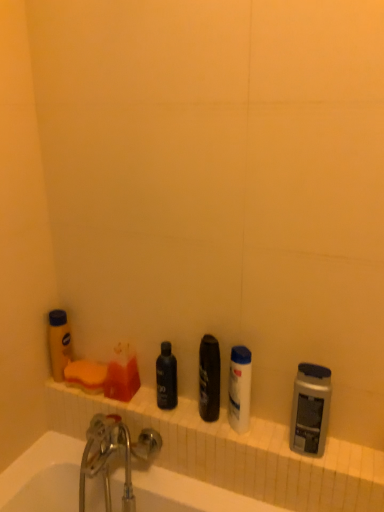
Question: Is white ceramic ledge at lower center positioned behind yellow matte bottle at left, marked as the 1th toiletry in a left-to-right arrangement?

Choices:
 (A) yes
 (B) no

Answer: (B)

Question: Would you say white ceramic ledge at lower center contains yellow matte bottle at left, the 5th toiletry when ordered from right to left?

Choices:
 (A) yes
 (B) no

Answer: (B)

Question: From a real-world perspective, is white ceramic ledge at lower center beneath yellow matte bottle at left, marked as the 1th toiletry in a left-to-right arrangement?

Choices:
 (A) yes
 (B) no

Answer: (A)

Question: From a real-world perspective, is white ceramic ledge at lower center on yellow matte bottle at left, marked as the 1th toiletry in a left-to-right arrangement?

Choices:
 (A) yes
 (B) no

Answer: (B)

Question: Does white ceramic ledge at lower center have a smaller size compared to yellow matte bottle at left, marked as the 1th toiletry in a left-to-right arrangement?

Choices:
 (A) yes
 (B) no

Answer: (B)

Question: Looking at their shapes, would you say yellow matte bottle at left, the 5th toiletry when ordered from right to left, is wider or thinner than translucent plastic soap at upper left, the 2th toiletry in the left-to-right sequence?

Choices:
 (A) thin
 (B) wide

Answer: (A)

Question: Looking at the image, does yellow matte bottle at left, the 5th toiletry when ordered from right to left, seem bigger or smaller compared to translucent plastic soap at upper left, which is counted as the fourth toiletry, starting from the right?

Choices:
 (A) small
 (B) big

Answer: (B)

Question: Would you say yellow matte bottle at left, the 5th toiletry when ordered from right to left, is inside or outside translucent plastic soap at upper left, which is counted as the fourth toiletry, starting from the right?

Choices:
 (A) outside
 (B) inside

Answer: (A)

Question: Is point (66, 350) closer or farther from the camera than point (127, 380)?

Choices:
 (A) farther
 (B) closer

Answer: (A)

Question: Visually, is black matte bottle at center, which is the third toiletry in left-to-right order, positioned to the left or to the right of shiny black can at center, placed as the fourth toiletry when sorted from left to right?

Choices:
 (A) left
 (B) right

Answer: (A)

Question: Is black matte bottle at center, marked as the 3th toiletry in a right-to-left arrangement, wider or thinner than shiny black can at center, placed as the fourth toiletry when sorted from left to right?

Choices:
 (A) wide
 (B) thin

Answer: (B)

Question: Does point (175, 392) appear closer or farther from the camera than point (218, 369)?

Choices:
 (A) farther
 (B) closer

Answer: (A)

Question: Choose the correct answer: Is black matte bottle at center, marked as the 3th toiletry in a right-to-left arrangement, inside shiny black can at center, which is the 2th toiletry from right to left, or outside it?

Choices:
 (A) outside
 (B) inside

Answer: (A)

Question: In the image, is metallic gray shaver at right, the first toiletry in the right-to-left sequence, positioned in front of or behind yellow matte bottle at left, the 5th toiletry when ordered from right to left?

Choices:
 (A) front
 (B) behind

Answer: (A)

Question: In terms of width, does metallic gray shaver at right, the first toiletry in the right-to-left sequence, look wider or thinner when compared to yellow matte bottle at left, marked as the 1th toiletry in a left-to-right arrangement?

Choices:
 (A) wide
 (B) thin

Answer: (A)